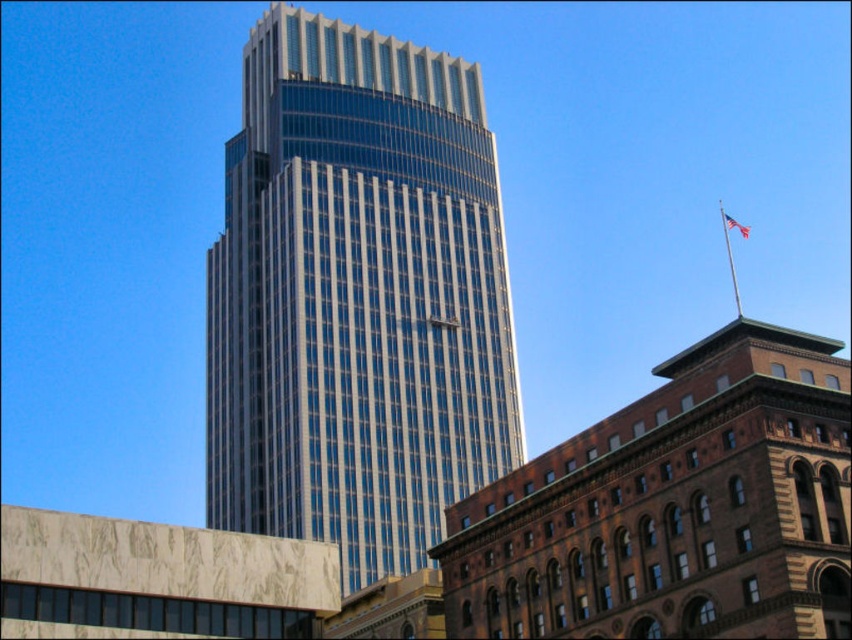
Does glassy steel skyscraper at center have a larger size compared to red fabric flag at upper right?

Indeed, glassy steel skyscraper at center has a larger size compared to red fabric flag at upper right.

This screenshot has width=852, height=640. Identify the location of glassy steel skyscraper at center. (355, 298).